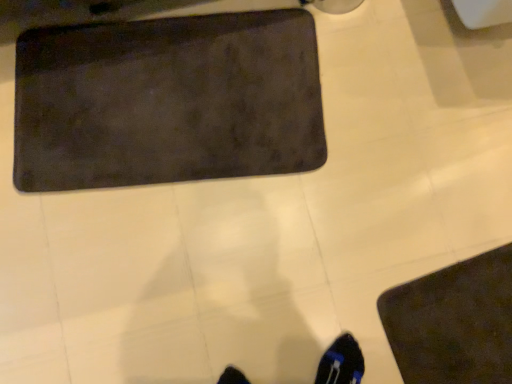
You are a GUI agent. You are given a task and a screenshot of the screen. Output one action in this format:
    pyautogui.click(x=<x>, y=<y>)
    Task: Click on the free point above dark matte mat at upper left (from a real-world perspective)
    
    Given the screenshot: What is the action you would take?
    pyautogui.click(x=172, y=93)